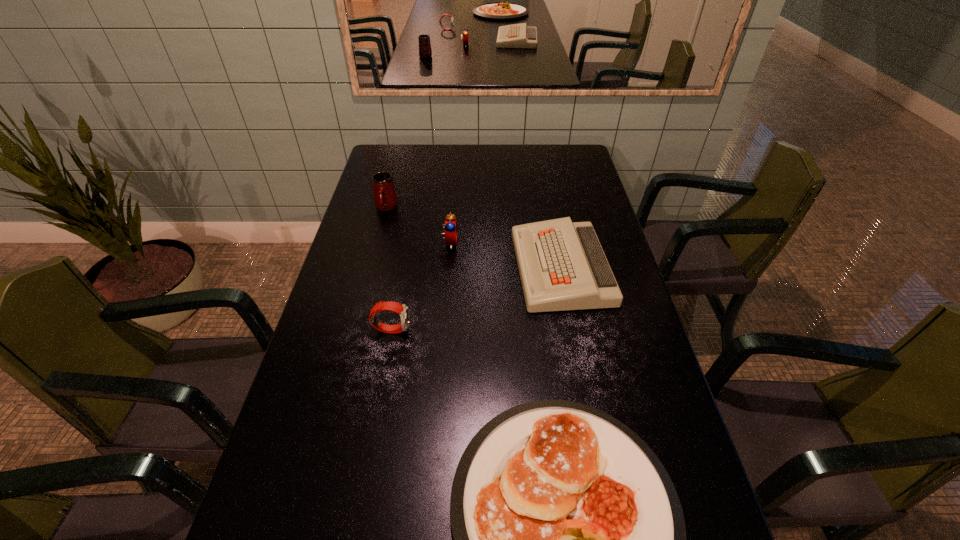
This screenshot has height=540, width=960. I want to click on mug present at the left edge, so click(x=385, y=198).

At what (x,y) coordinates should I click in order to perform the action: click on watch at the left edge. Please return your answer as a coordinate pair (x, y). This screenshot has width=960, height=540. Looking at the image, I should click on (401, 309).

Locate an element on the screen. The width and height of the screenshot is (960, 540). object located at the right edge is located at coordinates (562, 266).

Image resolution: width=960 pixels, height=540 pixels. In order to click on free space at the far edge of the desktop in this screenshot , I will do `click(514, 157)`.

You are a GUI agent. You are given a task and a screenshot of the screen. Output one action in this format:
    pyautogui.click(x=<x>, y=<y>)
    Task: Click on the free space at the left edge of the desktop
    The height and width of the screenshot is (540, 960).
    Given the screenshot: What is the action you would take?
    pyautogui.click(x=381, y=269)

Where is `vacant space at the right edge of the desktop`? The image size is (960, 540). vacant space at the right edge of the desktop is located at coordinates (599, 372).

I want to click on vacant space at the far right corner of the desktop, so click(551, 146).

Locate an element on the screen. This screenshot has height=540, width=960. vacant space that's between the farthest object and the fourth object from right to left is located at coordinates (389, 268).

The image size is (960, 540). Identify the location of blank region between the third object from right to left and the fourth object from right to left. (420, 286).

Where is `free space between the leftmost object and the alarm clock`? free space between the leftmost object and the alarm clock is located at coordinates (418, 225).